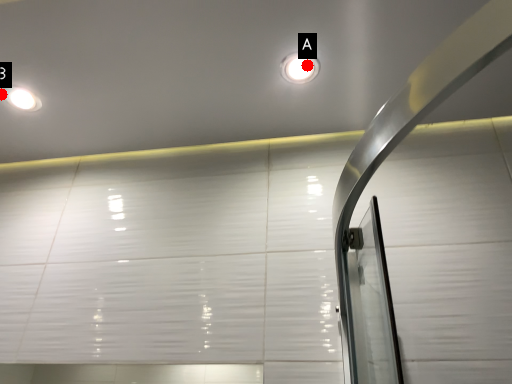
Question: Two points are circled on the image, labeled by A and B beside each circle. Which point appears farthest from the camera in this image?

Choices:
 (A) A is further
 (B) B is further

Answer: (B)